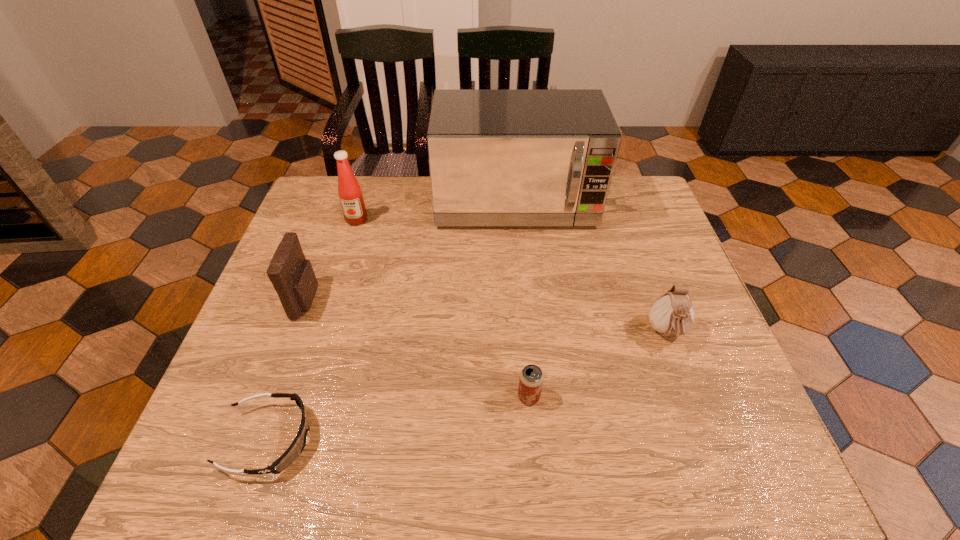
Locate an element on the screen. This screenshot has height=540, width=960. microwave oven is located at coordinates (497, 157).

Locate an element on the screen. the fifth shortest object is located at coordinates (349, 191).

You are a GUI agent. You are given a task and a screenshot of the screen. Output one action in this format:
    pyautogui.click(x=<x>, y=<y>)
    Task: Click on the fourth shortest object
    The height and width of the screenshot is (540, 960).
    Given the screenshot: What is the action you would take?
    pyautogui.click(x=293, y=278)

In order to click on the left pouch in this screenshot , I will do `click(293, 278)`.

You are a GUI agent. You are given a task and a screenshot of the screen. Output one action in this format:
    pyautogui.click(x=<x>, y=<y>)
    Task: Click on the shorter pouch
    This screenshot has width=960, height=540.
    Given the screenshot: What is the action you would take?
    pyautogui.click(x=672, y=314)

I want to click on the right pouch, so click(672, 314).

This screenshot has height=540, width=960. I want to click on beer can, so click(531, 378).

Locate an element on the screen. the shortest object is located at coordinates (295, 449).

Locate an element on the screen. free space located 0.100m with the door open on the microwave oven is located at coordinates (520, 260).

Where is `vacant region located 0.070m on the front-facing side of the condiment`? This screenshot has height=540, width=960. vacant region located 0.070m on the front-facing side of the condiment is located at coordinates (349, 242).